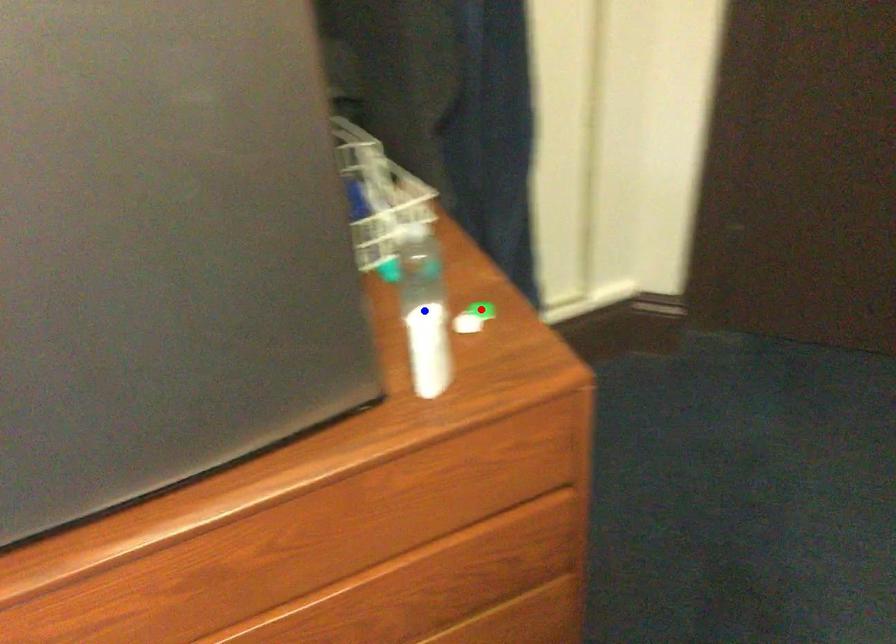
Question: Two points are marked on the image. Which point is closer to the camera?

Choices:
 (A) Blue point is closer.
 (B) Red point is closer.

Answer: (A)